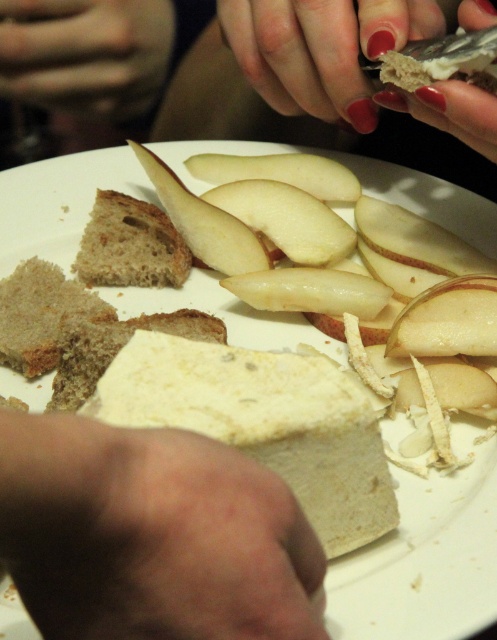
You are a GUI agent. You are given a task and a screenshot of the screen. Output one action in this format:
    pyautogui.click(x=<x>, y=<y>)
    Task: Click on the smooth skin hand at upper center
    
    Given the screenshot: What is the action you would take?
    pyautogui.click(x=85, y=52)

Is smooth skin hand at upper center to the left of nail polish at upper center from the viewer's perspective?

Indeed, smooth skin hand at upper center is positioned on the left side of nail polish at upper center.

Who is more distant from viewer, (127,35) or (323,60)?

The point (127,35) is behind.

The height and width of the screenshot is (640, 497). What are the coordinates of `smooth skin hand at upper center` in the screenshot? It's located at (85, 52).

Is point (356, 131) closer to viewer compared to point (423, 132)?

Yes, it is.

The image size is (497, 640). Describe the element at coordinates (301, 56) in the screenshot. I see `nail polish at upper center` at that location.

This screenshot has height=640, width=497. What are the coordinates of `nail polish at upper center` in the screenshot? It's located at (301, 56).

Consider the image. Which is above, smooth skin hand at upper center or nail polish red fingernails at upper right?

smooth skin hand at upper center

Is point (9, 56) closer to viewer compared to point (479, 172)?

Yes, point (9, 56) is in front of point (479, 172).

Locate an element on the screen. smooth skin hand at upper center is located at coordinates (85, 52).